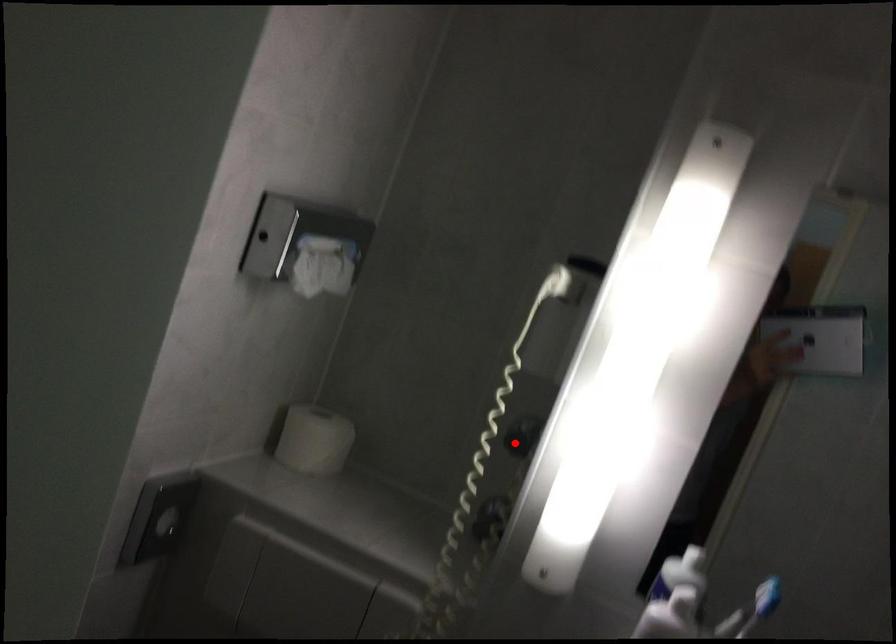
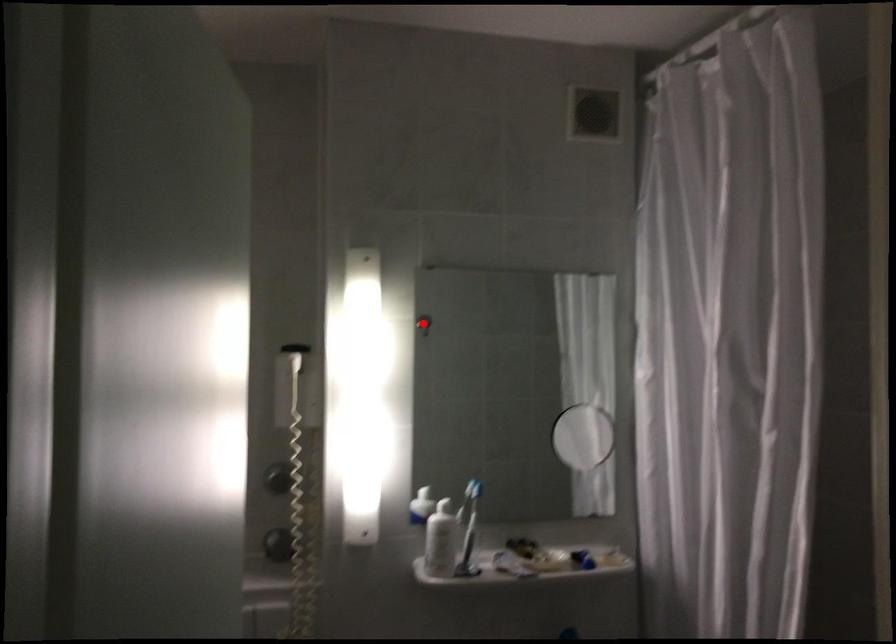
I am providing you with two images of the same scene from different viewpoints. A red point is marked on the first image and another point is marked on the second image. Do the highlighted points in image1 and image2 indicate the same real-world spot?

No